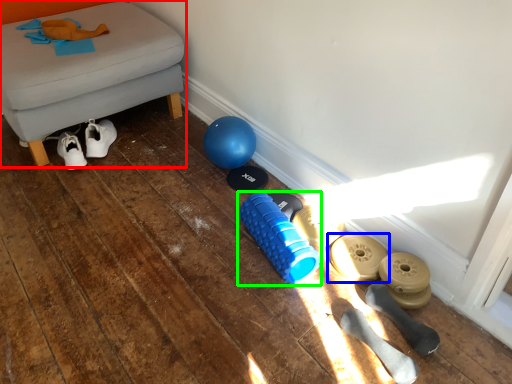
Question: Which object is positioned closest to furniture (highlighted by a red box)? Select from footwear (highlighted by a blue box) and dumbbell (highlighted by a green box).

Choices:
 (A) footwear
 (B) dumbbell

Answer: (B)